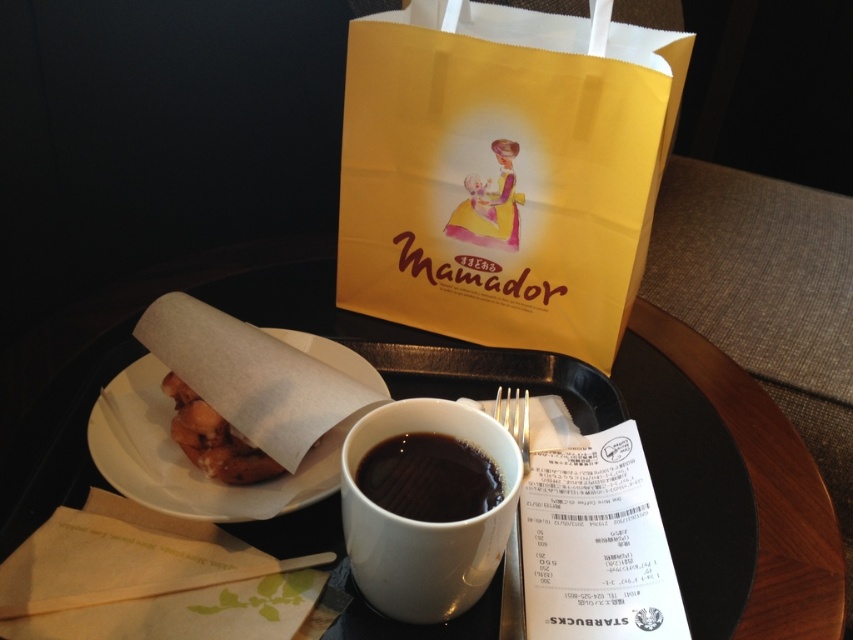
Does point (292, 547) come farther from viewer compared to point (146, 404)?

No, it is not.

Which is below, white matte tray at center or brown paper plate at center?

Positioned lower is brown paper plate at center.

Where is `white matte tray at center`? The image size is (853, 640). white matte tray at center is located at coordinates (x=701, y=472).

I want to click on white matte tray at center, so click(x=701, y=472).

Between yellow paper bag at upper center and silver metallic fork at upper center, which one appears on the right side from the viewer's perspective?

silver metallic fork at upper center

Does yellow paper bag at upper center have a greater height compared to silver metallic fork at upper center?

Correct, yellow paper bag at upper center is much taller as silver metallic fork at upper center.

Is point (616, 148) behind point (518, 433)?

No, it is not.

Where is `yellow paper bag at upper center`? yellow paper bag at upper center is located at coordinates (502, 172).

In the scene shown: Does yellow paper bag at upper center come in front of black matte cup at center?

No.

Does yellow paper bag at upper center have a larger size compared to black matte cup at center?

Correct, yellow paper bag at upper center is larger in size than black matte cup at center.

Does point (448, 250) come behind point (445, 461)?

Yes, point (448, 250) is farther from viewer.

This screenshot has height=640, width=853. Find the location of `yellow paper bag at upper center`. yellow paper bag at upper center is located at coordinates (502, 172).